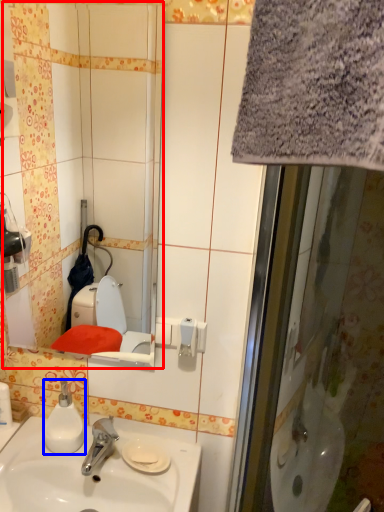
Question: Which of the following is the closest to the observer, mirror (highlighted by a red box) or soap dispenser (highlighted by a blue box)?

Choices:
 (A) mirror
 (B) soap dispenser

Answer: (A)